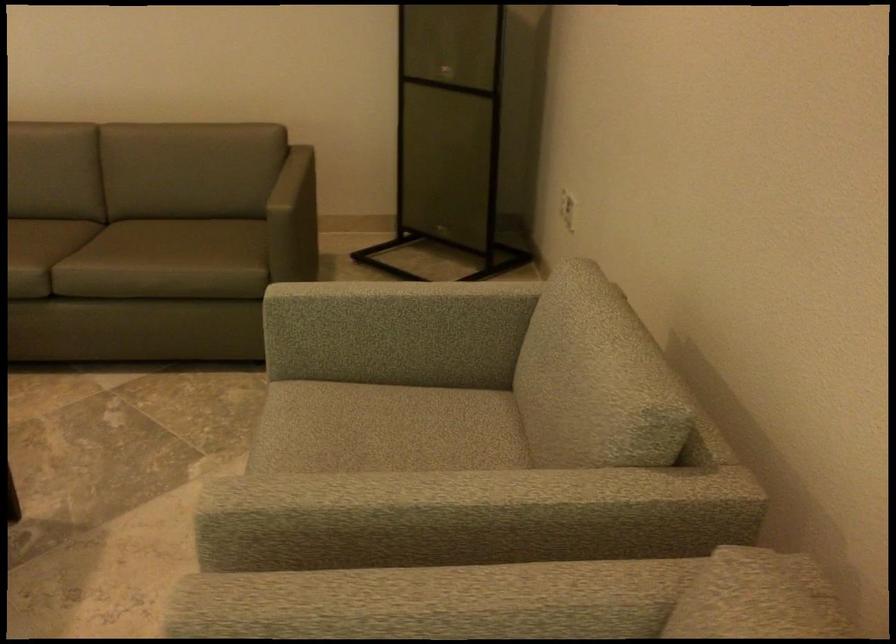
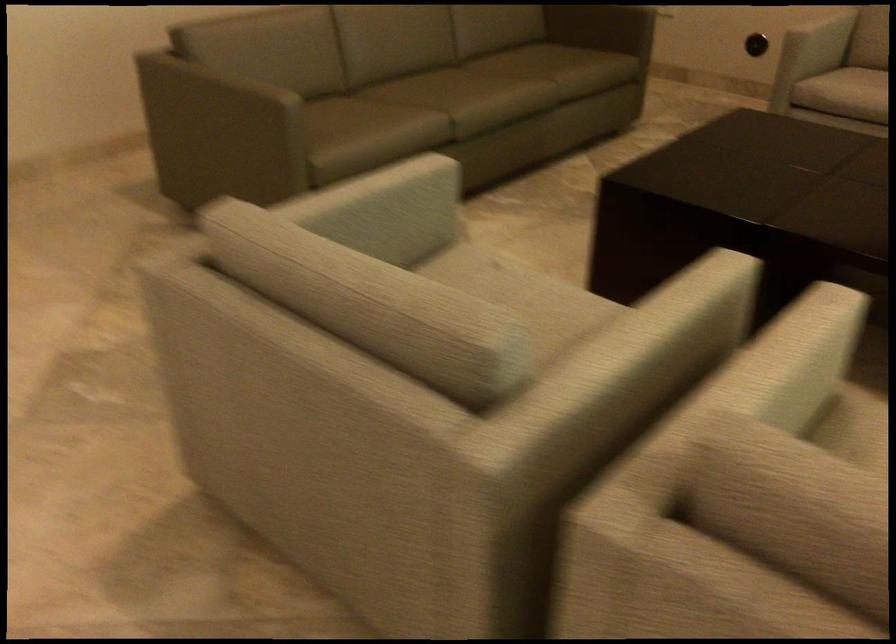
Find the pixel in the second image that matches (415,333) in the first image.

(821, 35)